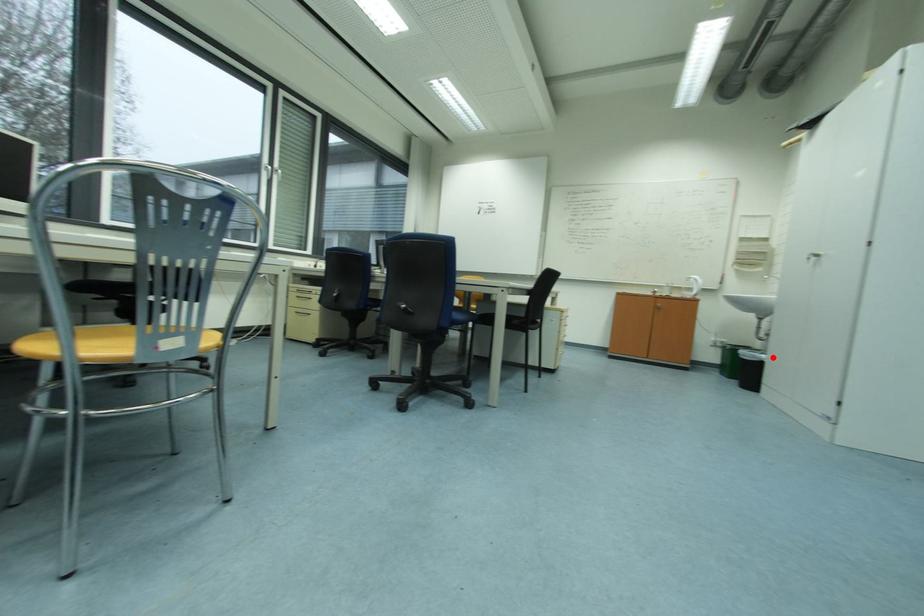
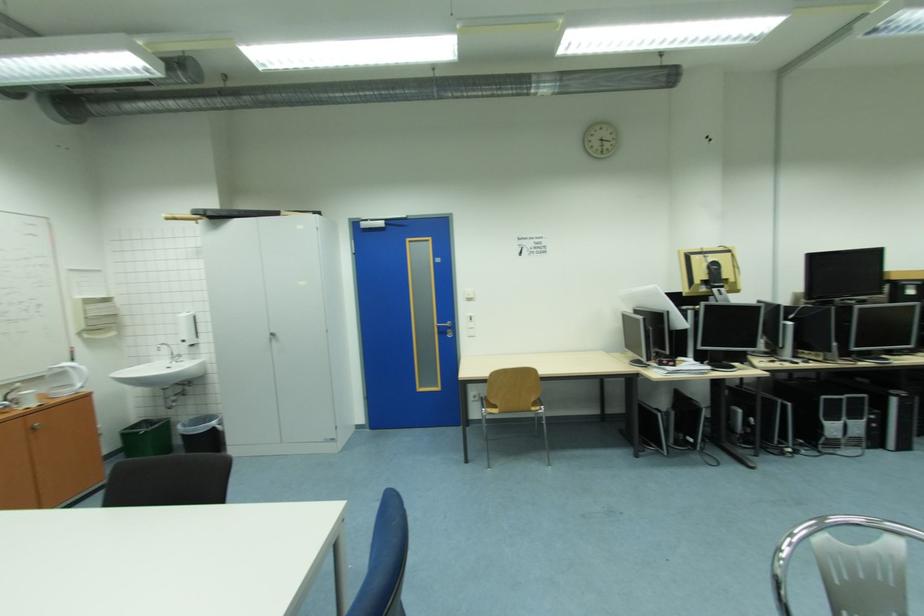
The point at the highlighted location is marked in the first image. Where is the corresponding point in the second image?

(220, 424)